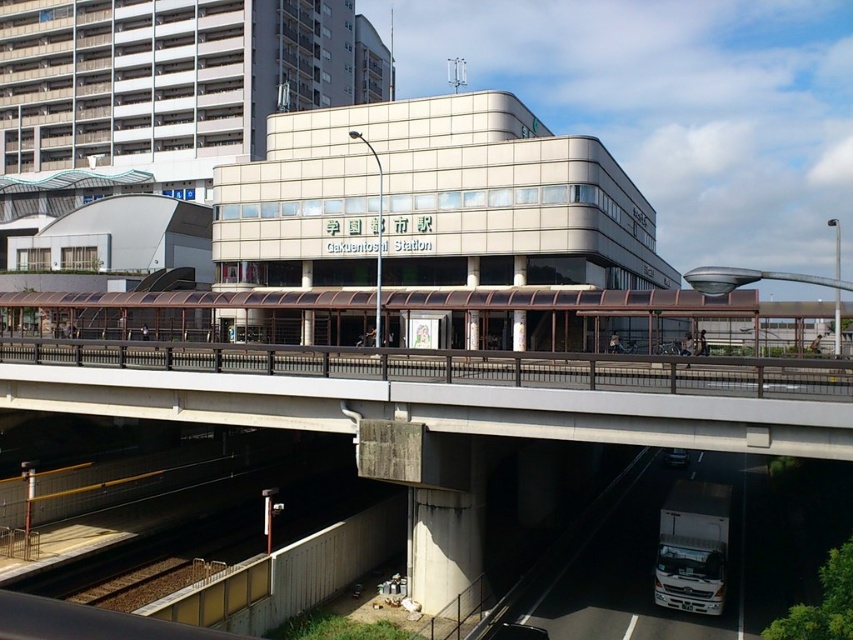
Question: In this image, where is concrete bridge at center located relative to white glossy truck at lower right?

Choices:
 (A) left
 (B) right

Answer: (A)

Question: Which is nearer to the white glossy truck at lower right?

Choices:
 (A) metallic silver truck at lower center
 (B) concrete bridge at center

Answer: (A)

Question: Which of the following is the closest to the observer?

Choices:
 (A) concrete bridge at center
 (B) metallic silver truck at lower center
 (C) white glossy truck at lower right

Answer: (A)

Question: Can you confirm if white glossy truck at lower right is positioned to the right of metallic silver truck at lower center?

Choices:
 (A) yes
 (B) no

Answer: (B)

Question: Which point is farther from the camera taking this photo?

Choices:
 (A) (677, 451)
 (B) (689, 609)
 (C) (523, 396)

Answer: (A)

Question: Can you confirm if concrete bridge at center is positioned to the left of white glossy truck at lower right?

Choices:
 (A) yes
 (B) no

Answer: (A)